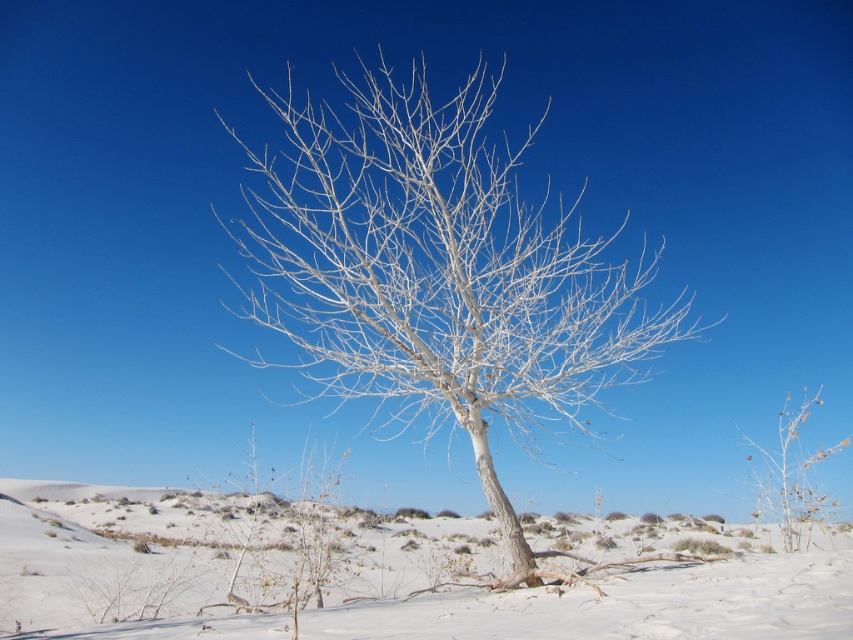
Who is positioned more to the left, white matte tree at center or white powdery snow at center?

Positioned to the left is white powdery snow at center.

Does white matte tree at center come behind white powdery snow at center?

Yes, it is behind white powdery snow at center.

Does point (608, 326) come behind point (393, 600)?

Yes, it is behind point (393, 600).

What are the coordinates of `white matte tree at center` in the screenshot? It's located at (438, 272).